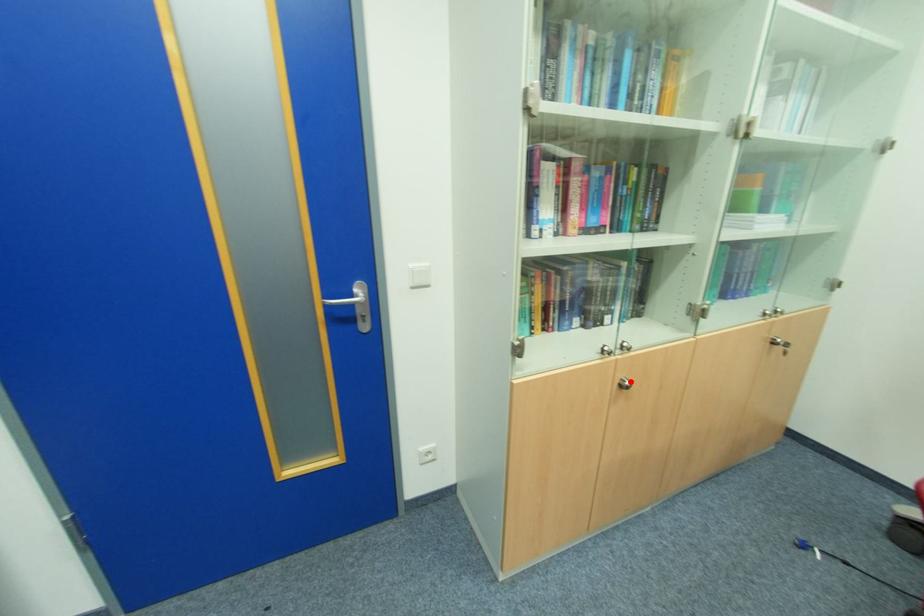
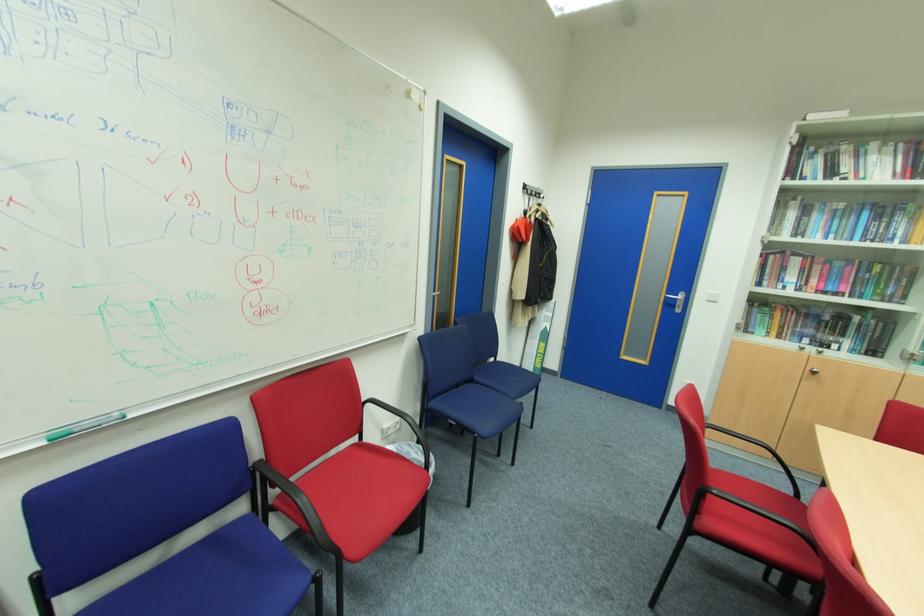
Locate, in the second image, the point that corresponds to the highlighted location in the first image.

(820, 371)